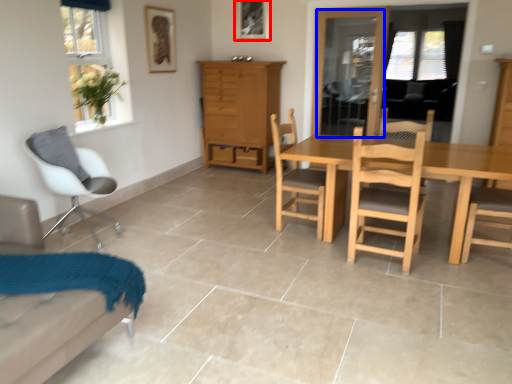
Question: Among these objects, which one is farthest to the camera, picture frame (highlighted by a red box) or glass door (highlighted by a blue box)?

Choices:
 (A) picture frame
 (B) glass door

Answer: (A)